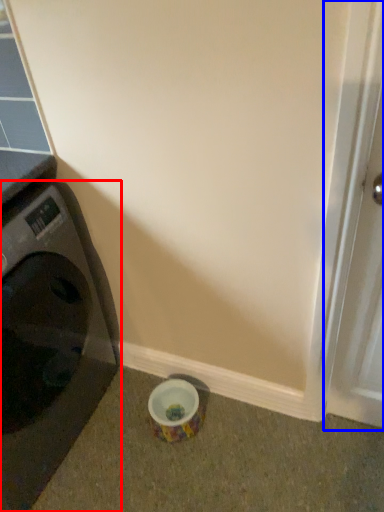
Question: Which object appears closest to the camera in this image, washing machine (highlighted by a red box) or screen door (highlighted by a blue box)?

Choices:
 (A) washing machine
 (B) screen door

Answer: (B)